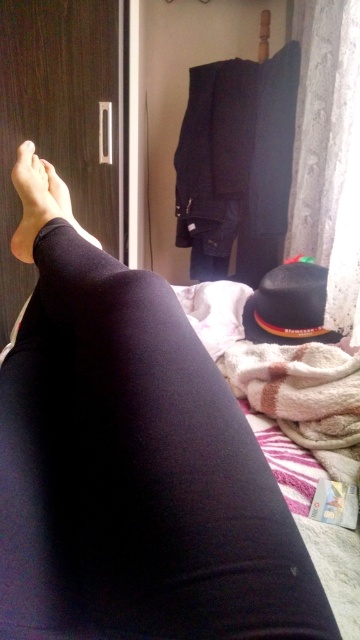
You are a delivery robot entering a room and need to place a small package on the surface next to the black felt hat at lower right and the black matte legging at lower left. Which object should you place the package closer to if you want it to be more visible from the doorway?

The black felt hat at lower right should be chosen because it has a greater height compared to the black matte legging at lower left, making the package more visible when placed near it.

You are a photographer setting up a shot of the scene. You need to focus on the black matte leggings at lower left and the white textured curtain at right. Which object should you adjust your camera focus to first if you want to capture both in sharp detail?

The black matte leggings at lower left is closer to the viewer than the white textured curtain at right, so you should focus on the black matte leggings at lower left first to ensure both are in sharp detail.

You are a delivery person who needs to place a small package on the bed without disturbing the black felt hat at lower right and the black matte legging at lower left. Where should you place the package?

Place the package to the left of the black felt hat at lower right or to the right of the black matte legging at lower left since the hat is already to the right of the legging, leaving space on either side.